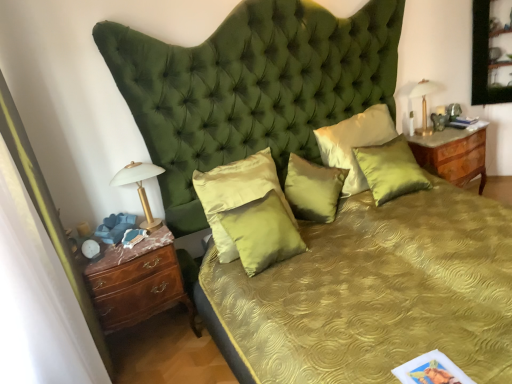
Question: Is white glass bedside lamp at left, marked as the 1th bedside lamp in a front-to-back arrangement, closer to camera compared to satin green pillow at center, acting as the 2th pillow starting from the right?

Choices:
 (A) yes
 (B) no

Answer: (A)

Question: Considering the relative sizes of white glass bedside lamp at left, acting as the first bedside lamp starting from the bottom, and satin green pillow at center, acting as the 2th pillow starting from the right, in the image provided, is white glass bedside lamp at left, acting as the first bedside lamp starting from the bottom, bigger than satin green pillow at center, acting as the 2th pillow starting from the right,?

Choices:
 (A) yes
 (B) no

Answer: (B)

Question: Does white glass bedside lamp at left, positioned as the 2th bedside lamp in top-to-bottom order, have a lesser height compared to satin green pillow at center, which is the fourth pillow from left to right?

Choices:
 (A) yes
 (B) no

Answer: (A)

Question: Considering the relative sizes of white glass bedside lamp at left, marked as the first bedside lamp in a left-to-right arrangement, and satin green pillow at center, acting as the 2th pillow starting from the right, in the image provided, is white glass bedside lamp at left, marked as the first bedside lamp in a left-to-right arrangement, taller than satin green pillow at center, acting as the 2th pillow starting from the right,?

Choices:
 (A) yes
 (B) no

Answer: (B)

Question: Is white glass bedside lamp at left, marked as the 1th bedside lamp in a front-to-back arrangement, looking in the opposite direction of satin green pillow at center, acting as the 2th pillow starting from the right?

Choices:
 (A) yes
 (B) no

Answer: (B)

Question: Would you say satin green pillow at center, acting as the 2th pillow starting from the right, is part of white glass bedside lamp at left, marked as the 1th bedside lamp in a front-to-back arrangement,'s contents?

Choices:
 (A) yes
 (B) no

Answer: (B)

Question: Are satin green pillow at center, which is the fourth pillow from left to right, and gold metallic lamp at upper right, acting as the 2th bedside lamp starting from the bottom, beside each other?

Choices:
 (A) yes
 (B) no

Answer: (B)

Question: Is satin green pillow at center, acting as the 2th pillow starting from the right, thinner than gold metallic lamp at upper right, the 1th bedside lamp from the top?

Choices:
 (A) no
 (B) yes

Answer: (A)

Question: Is satin green pillow at center, which is the fourth pillow from left to right, oriented away from gold metallic lamp at upper right, the 1th bedside lamp from the top?

Choices:
 (A) yes
 (B) no

Answer: (B)

Question: Does satin green pillow at center, acting as the 2th pillow starting from the right, appear on the right side of gold metallic lamp at upper right, marked as the first bedside lamp in a back-to-front arrangement?

Choices:
 (A) no
 (B) yes

Answer: (A)

Question: From a real-world perspective, is satin green pillow at center, acting as the 2th pillow starting from the right, positioned over gold metallic lamp at upper right, the first bedside lamp viewed from the right, based on gravity?

Choices:
 (A) yes
 (B) no

Answer: (B)

Question: Are satin gold pillow at center, the first pillow from the left, and burlwood/marble nightstand at right beside each other?

Choices:
 (A) yes
 (B) no

Answer: (B)